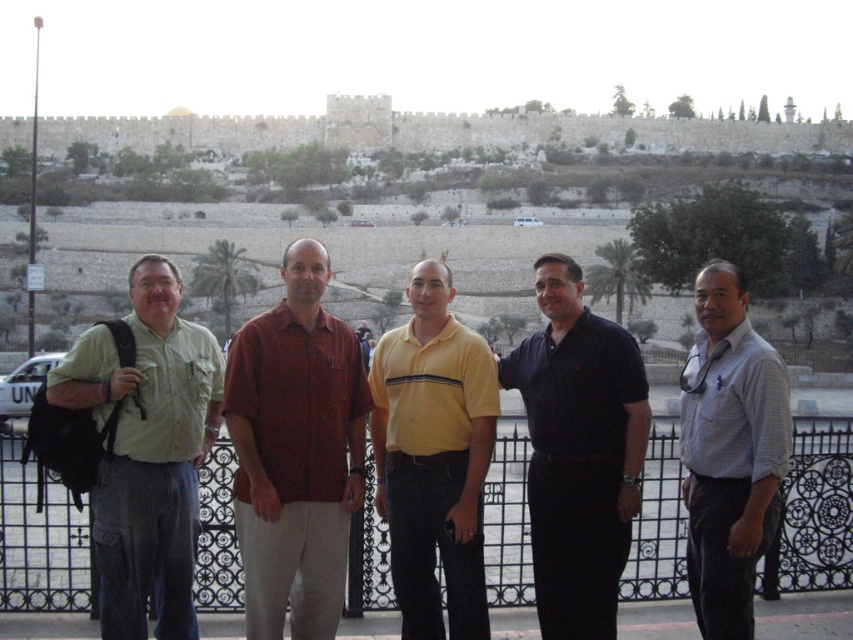
You are standing at the point labeled as point (38, 540). What object is located at that point?

The point (38, 540) corresponds to the black metal fence at center.

You are a photographer trying to capture a photo of the black matte shirt at center and the white checkered shirt at right. If you want to focus on the person closer to you, which one should you aim for?

The black matte shirt at center is closer to you, so you should aim for the black matte shirt at center to focus on the person closer to you.

You are standing at the position of point (740, 602) and want to move towards the direction of point (444, 509). According to the scene, will you be moving forward or backward relative to your current position?

Since point (444, 509) is behind point (740, 602), moving towards it would mean moving backward relative to your current position at point (740, 602).